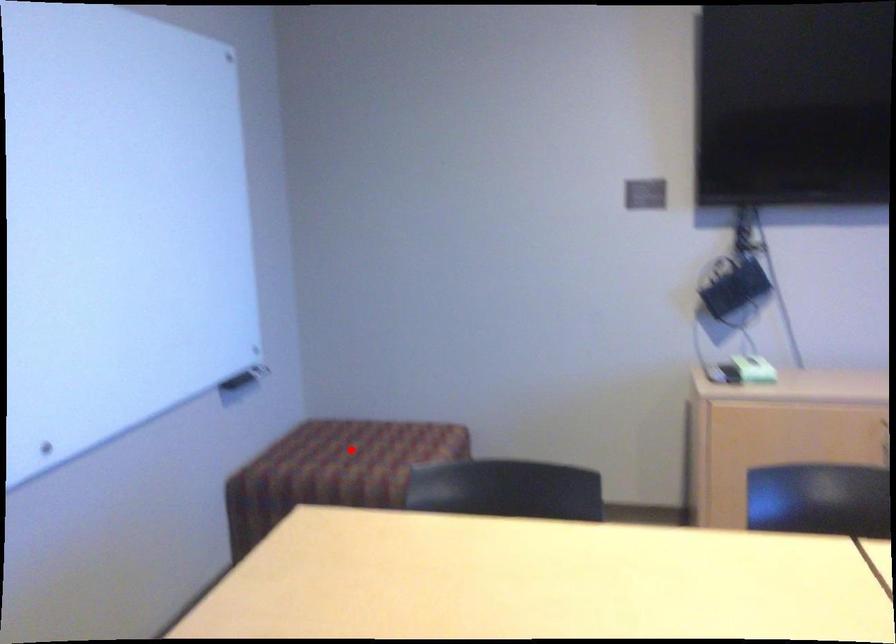
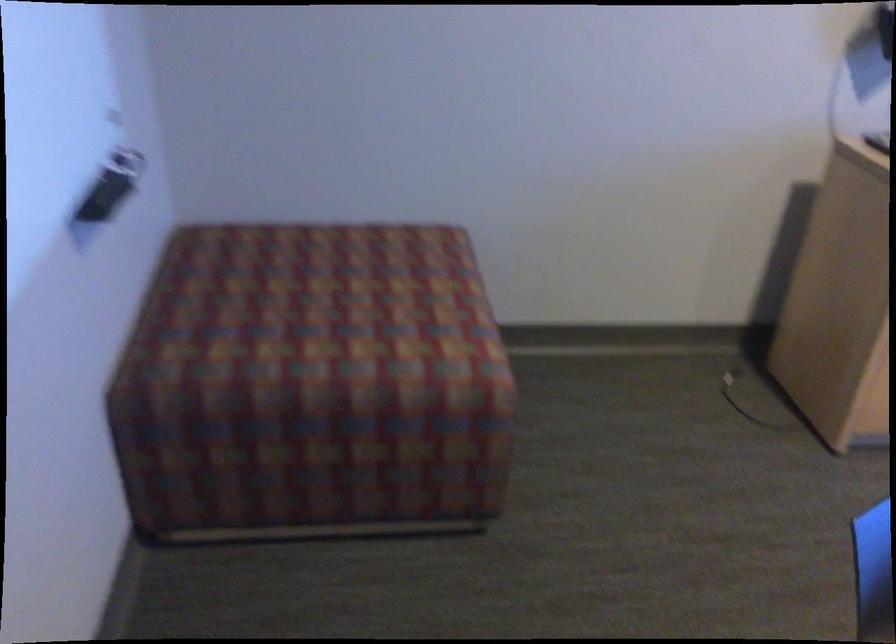
Question: I am providing you with two images of the same scene from different viewpoints. A red point is shown in image1. For the corresponding object point in image2, is it positioned nearer or farther from the camera?

Choices:
 (A) Nearer
 (B) Farther

Answer: (A)